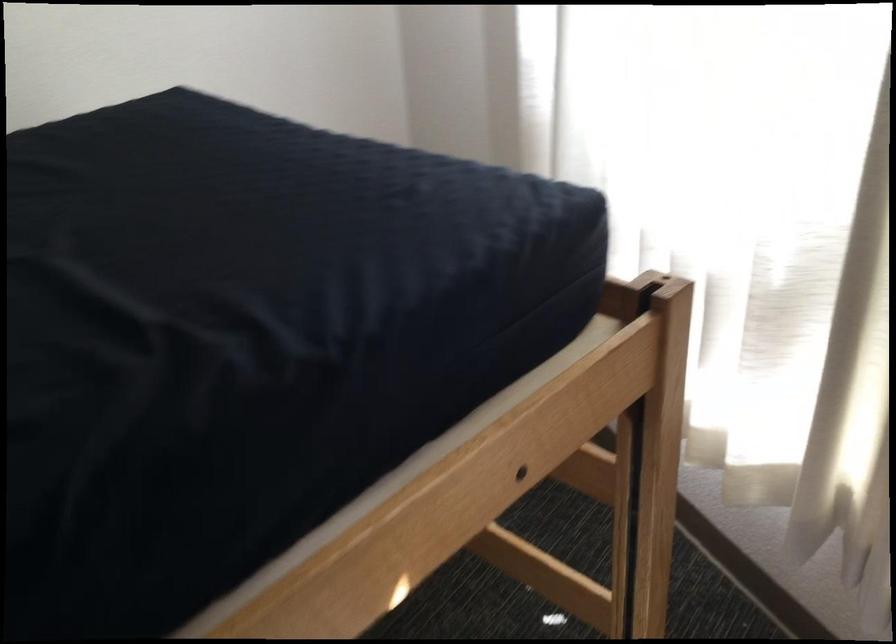
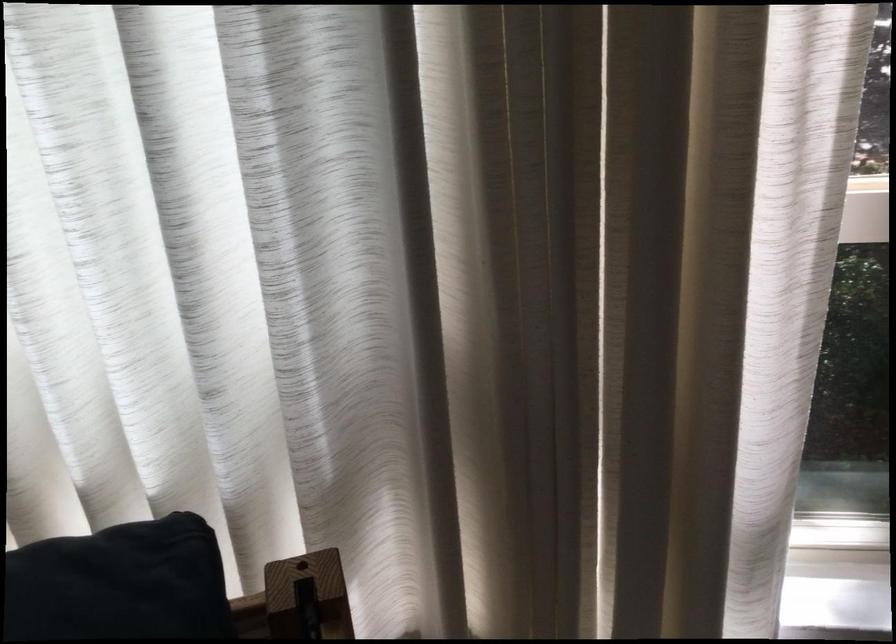
Question: The camera is either moving clockwise (left) or counter-clockwise (right) around the object. The first image is from the beginning of the video and the second image is from the end. Is the camera moving left or right when shooting the video?

Choices:
 (A) Left
 (B) Right

Answer: (A)